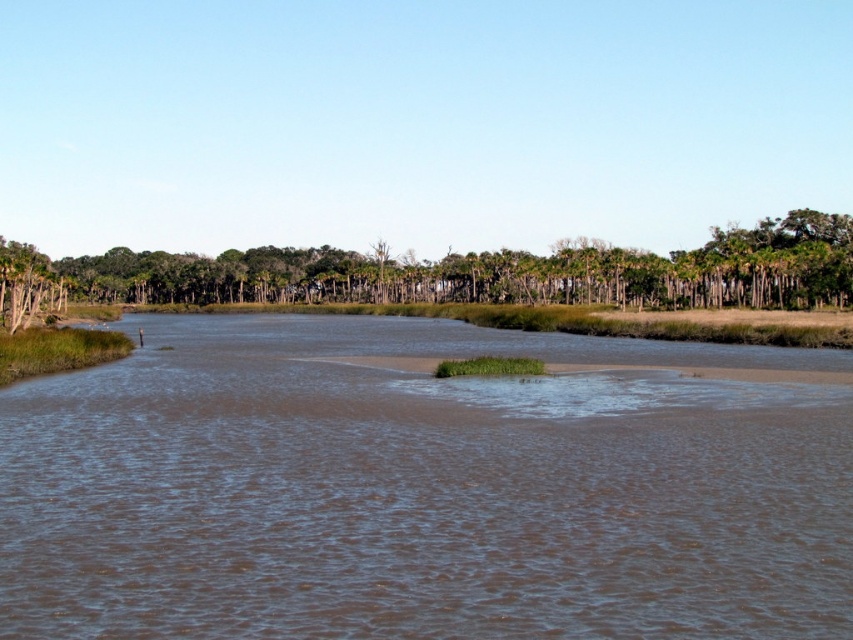
Does brown muddy water at center have a larger size compared to green leafy trees at center?

No.

Can you confirm if brown muddy water at center is taller than green leafy trees at center?

Incorrect, brown muddy water at center's height is not larger of green leafy trees at center's.

You are a GUI agent. You are given a task and a screenshot of the screen. Output one action in this format:
    pyautogui.click(x=<x>, y=<y>)
    Task: Click on the brown muddy water at center
    The image size is (853, 640).
    Given the screenshot: What is the action you would take?
    pyautogui.click(x=421, y=490)